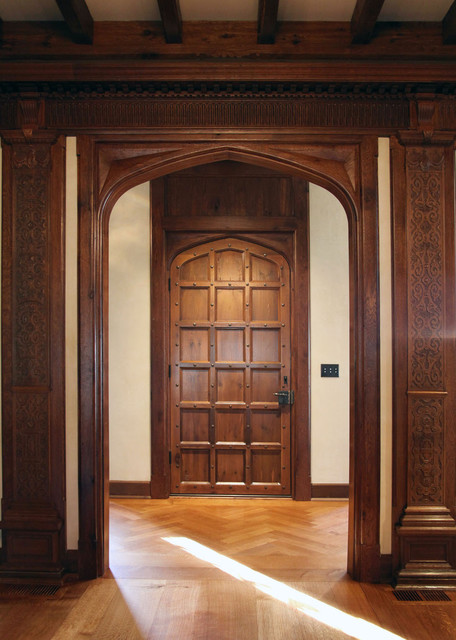
Where is `carvings in wall`? carvings in wall is located at coordinates (34, 339), (36, 477), (420, 486), (426, 273).